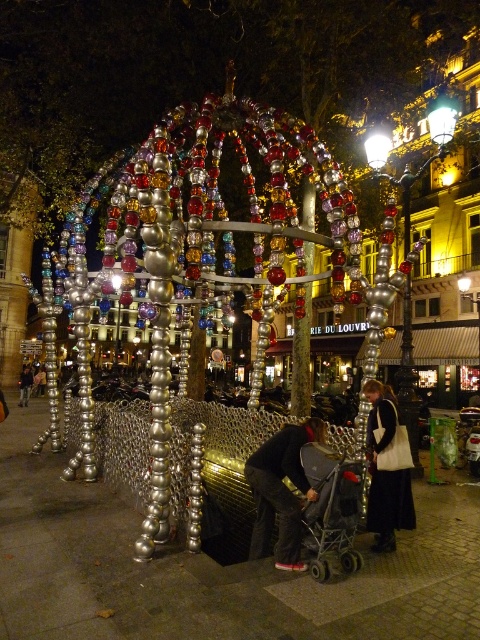
Is shiny metallic beads at center positioned at the back of black leather jacket at lower right?

No, it is in front of black leather jacket at lower right.

What do you see at coordinates (192, 248) in the screenshot? This screenshot has width=480, height=640. I see `shiny metallic beads at center` at bounding box center [192, 248].

The height and width of the screenshot is (640, 480). Describe the element at coordinates (192, 248) in the screenshot. I see `shiny metallic beads at center` at that location.

Identify the location of shiny metallic beads at center. This screenshot has width=480, height=640. (192, 248).

Does dark gray fabric stroller at center lie in front of metallic gray baby carriage at center?

Yes, it is in front of metallic gray baby carriage at center.

Which is behind, point (284, 426) or point (323, 538)?

The point (284, 426) is behind.

I want to click on dark gray fabric stroller at center, so click(x=280, y=492).

Is metallic gray baby carriage at center thinner than black leather jacket at lower right?

Yes, metallic gray baby carriage at center is thinner than black leather jacket at lower right.

Is point (338, 518) closer to viewer compared to point (382, 484)?

Yes, point (338, 518) is closer to viewer.

Between point (360, 486) and point (383, 493), which one is positioned in front?

Point (360, 486)

Identify the location of metallic gray baby carriage at center. (331, 508).